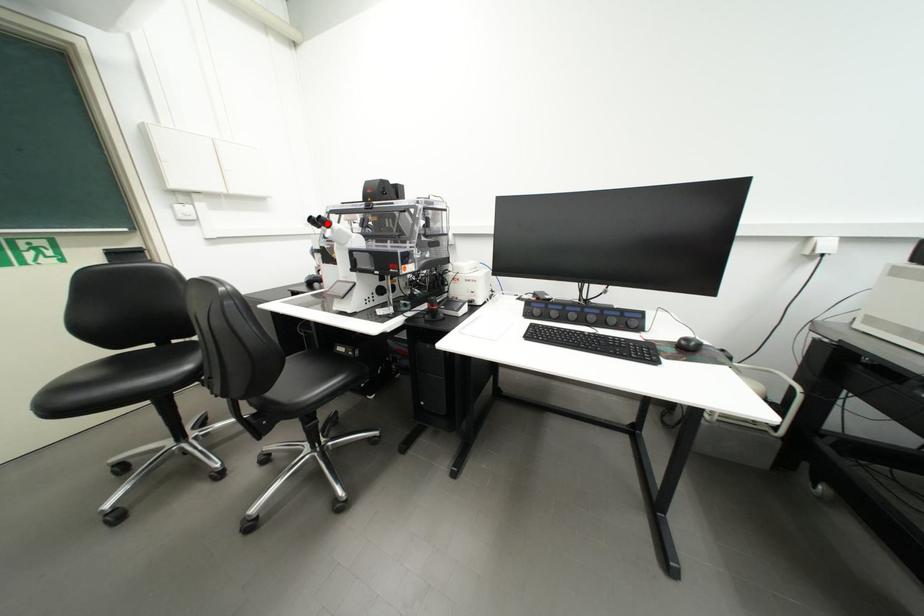
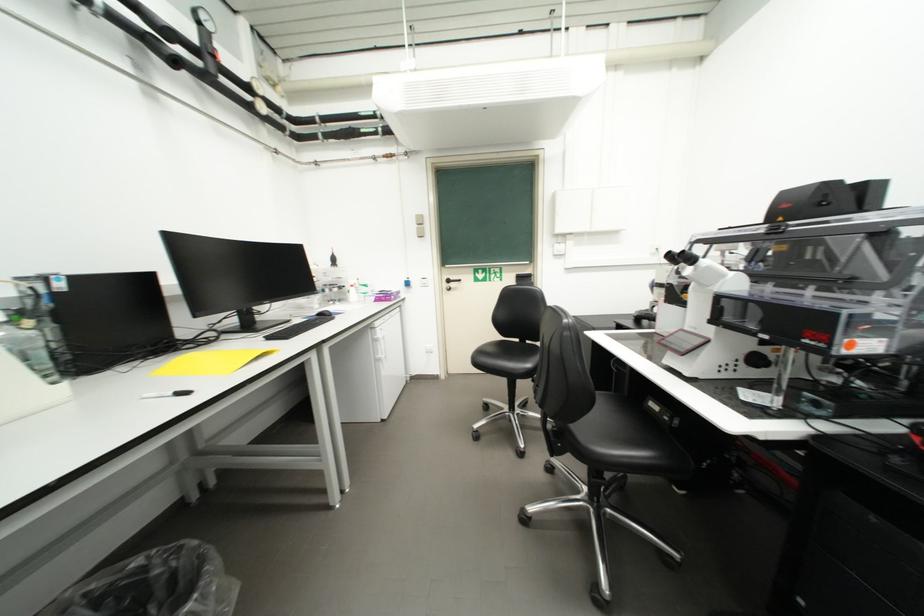
In the second image, find the point that corresponds to the highlighted location in the first image.

(687, 259)